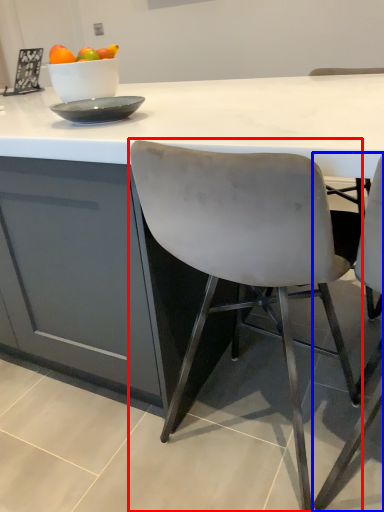
Question: Which object appears closest to the camera in this image, chair (highlighted by a red box) or chair (highlighted by a blue box)?

Choices:
 (A) chair
 (B) chair

Answer: (B)